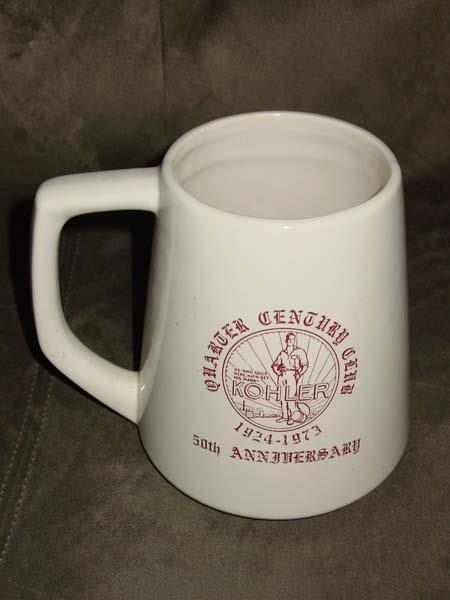
Image resolution: width=450 pixels, height=600 pixels. I want to click on long gray piece of fabric, so (x=29, y=436).